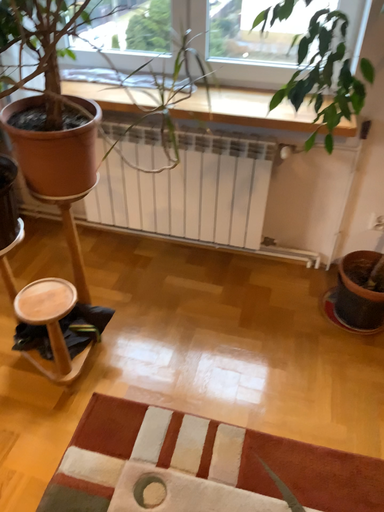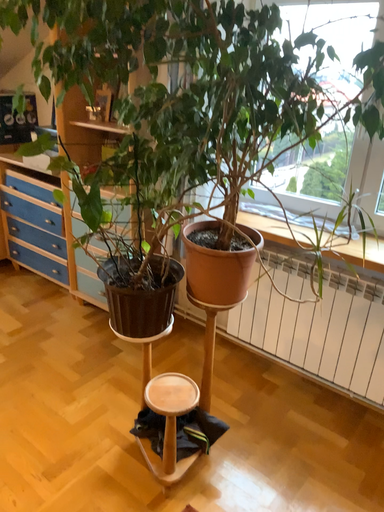
Question: Which way did the camera rotate in the video?

Choices:
 (A) rotated left
 (B) rotated right

Answer: (A)